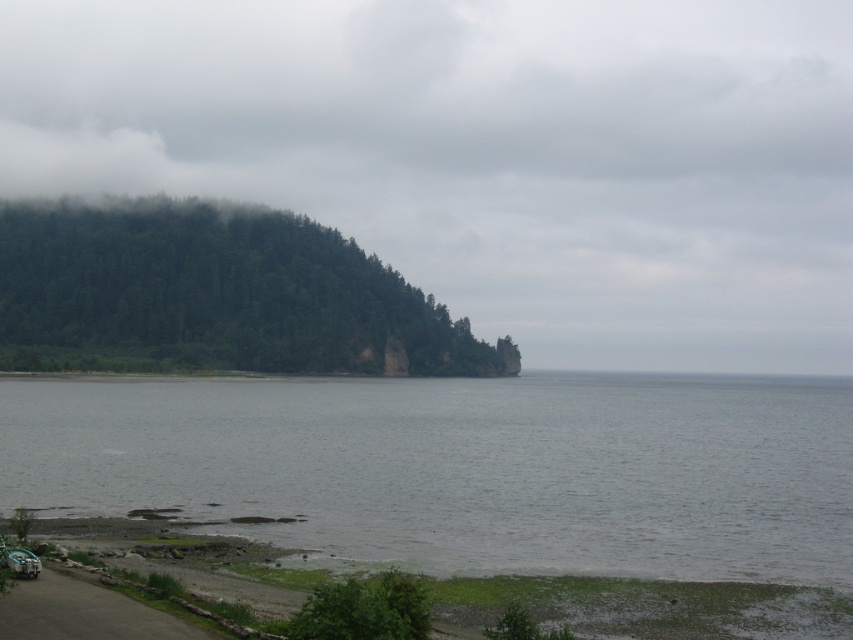
Who is taller, green matte forest at upper left or green leafy tree at lower center?

With more height is green matte forest at upper left.

Is green matte forest at upper left bigger than green leafy tree at lower center?

Correct, green matte forest at upper left is larger in size than green leafy tree at lower center.

Who is more distant from viewer, [73,321] or [340,624]?

Point [73,321]

Where is `green matte forest at upper left`? The height and width of the screenshot is (640, 853). green matte forest at upper left is located at coordinates (213, 296).

Between green forested hillside at upper left and green leafy tree at lower center, which one appears on the right side from the viewer's perspective?

Positioned to the right is green leafy tree at lower center.

Find the location of a particular element. green forested hillside at upper left is located at coordinates (489, 154).

Which is in front, point (840, 134) or point (390, 611)?

Point (390, 611) is in front.

The height and width of the screenshot is (640, 853). Identify the location of green forested hillside at upper left. (489, 154).

The width and height of the screenshot is (853, 640). What do you see at coordinates (463, 467) in the screenshot? I see `gray water at lower left` at bounding box center [463, 467].

Can you confirm if gray water at lower left is taller than green matte forest at upper left?

No.

Between point (560, 468) and point (447, 369), which one is positioned in front?

Positioned in front is point (560, 468).

Identify the location of gray water at lower left. (463, 467).